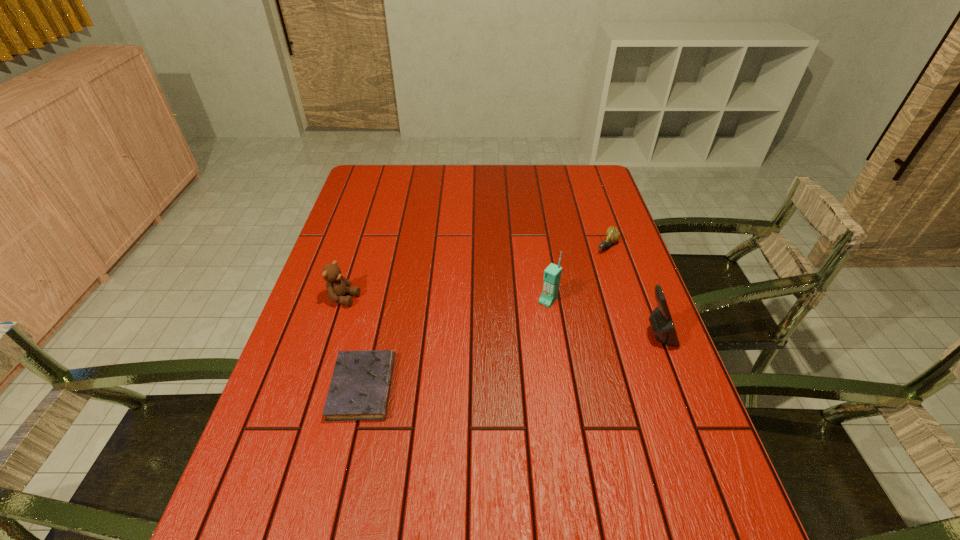
This screenshot has width=960, height=540. Find the location of `the nearest object`. the nearest object is located at coordinates (360, 386).

Identify the location of diary. Image resolution: width=960 pixels, height=540 pixels. (360, 386).

Where is `the right cellular telephone`? Image resolution: width=960 pixels, height=540 pixels. the right cellular telephone is located at coordinates (660, 319).

At what (x,y) coordinates should I click in order to perform the action: click on the fourth farthest object. Please return your answer as a coordinate pair (x, y). Looking at the image, I should click on (660, 319).

Identify the location of the farthest object. The width and height of the screenshot is (960, 540). (612, 234).

Image resolution: width=960 pixels, height=540 pixels. In order to click on escargot in this screenshot , I will do point(612,234).

Identify the location of the farther cellular telephone. (552, 274).

This screenshot has width=960, height=540. What are the coordinates of `the left cellular telephone` in the screenshot? It's located at (552, 274).

At what (x,y) coordinates should I click in order to perform the action: click on the third shortest object. Please return your answer as a coordinate pair (x, y). The image size is (960, 540). Looking at the image, I should click on (337, 286).

Image resolution: width=960 pixels, height=540 pixels. Identify the location of free space located on the right of the diary. (537, 387).